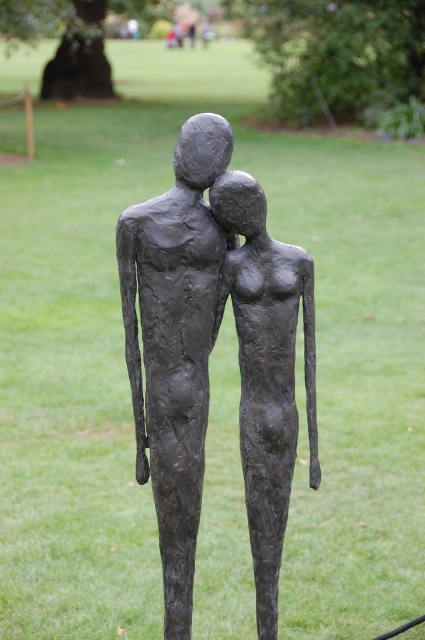
Question: Considering the relative positions of matte bronze couple at center and matte bronze figure at center in the image provided, where is matte bronze couple at center located with respect to matte bronze figure at center?

Choices:
 (A) below
 (B) above

Answer: (B)

Question: Is matte bronze couple at center smaller than matte bronze figure at center?

Choices:
 (A) no
 (B) yes

Answer: (A)

Question: Can you confirm if matte bronze couple at center is wider than matte bronze figure at center?

Choices:
 (A) yes
 (B) no

Answer: (A)

Question: Which point is closer to the camera taking this photo?

Choices:
 (A) (260, 604)
 (B) (155, 234)

Answer: (B)